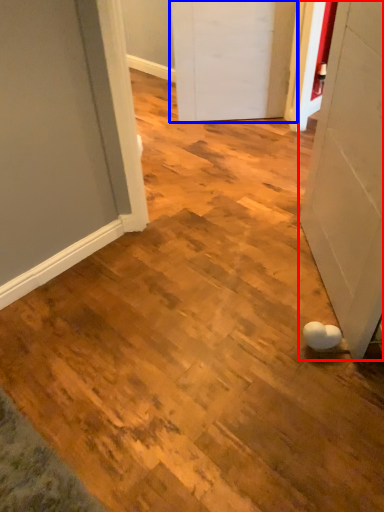
Question: Which of the following is the farthest to the observer, door (highlighted by a red box) or door (highlighted by a blue box)?

Choices:
 (A) door
 (B) door

Answer: (B)